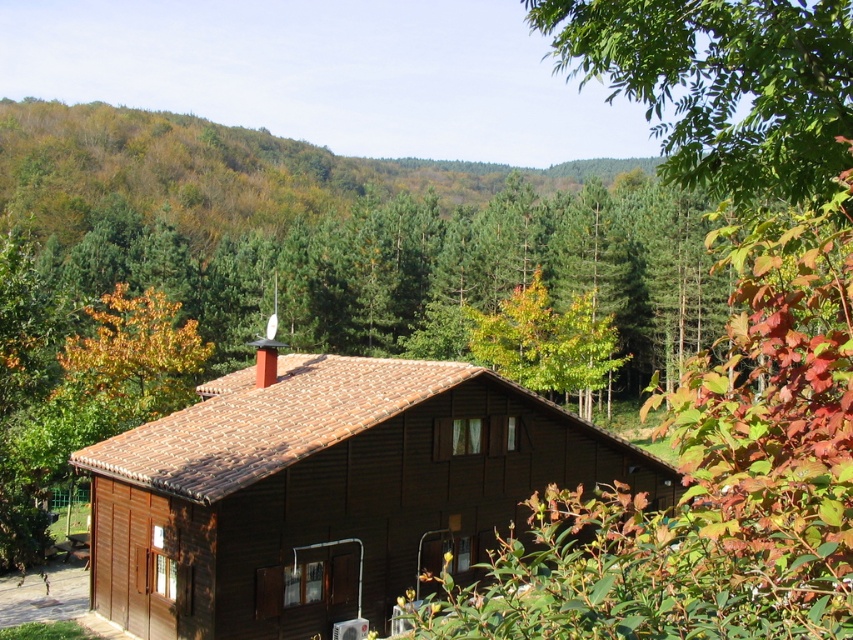
Question: Which point is farther to the camera?

Choices:
 (A) (270, 436)
 (B) (161, 316)

Answer: (B)

Question: Is brown wooden cabin at center to the left of yellow-green leaves at upper center from the viewer's perspective?

Choices:
 (A) yes
 (B) no

Answer: (B)

Question: Which of the following is the farthest from the observer?

Choices:
 (A) brown wooden cabin at center
 (B) yellow-green leaves at upper center

Answer: (B)

Question: From the image, what is the correct spatial relationship of brown wooden cabin at center in relation to yellow-green leaves at upper center?

Choices:
 (A) right
 (B) left

Answer: (A)

Question: Which point is farther from the camera taking this photo?

Choices:
 (A) (112, 292)
 (B) (113, 612)

Answer: (A)

Question: Considering the relative positions of brown wooden cabin at center and yellow-green leaves at upper center in the image provided, where is brown wooden cabin at center located with respect to yellow-green leaves at upper center?

Choices:
 (A) right
 (B) left

Answer: (A)